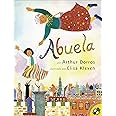
You are a GUI agent. You are given a task and a screenshot of the screen. Output one action in this format:
    pyautogui.click(x=<x>, y=<y>)
    Task: Click on the chimneys
    This screenshot has width=116, height=116.
    Given the screenshot: What is the action you would take?
    pyautogui.click(x=27, y=92), pyautogui.click(x=18, y=88), pyautogui.click(x=30, y=103), pyautogui.click(x=59, y=84), pyautogui.click(x=38, y=97), pyautogui.click(x=88, y=86), pyautogui.click(x=94, y=86)